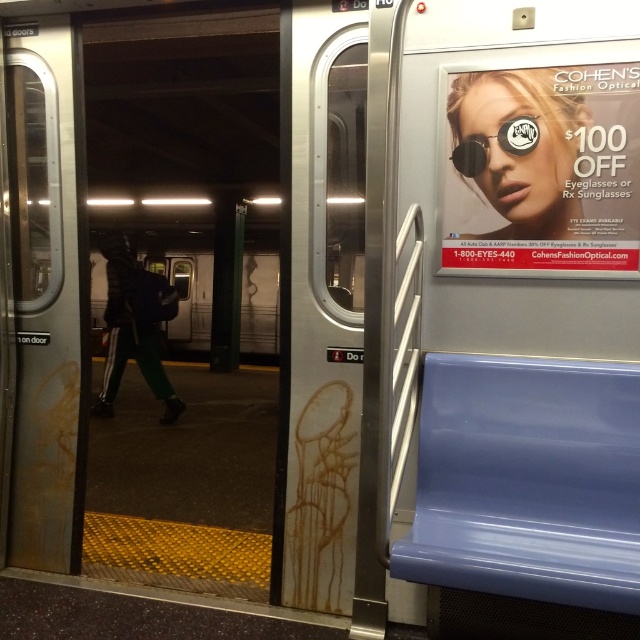
Question: Which of the following is the closest to the observer?

Choices:
 (A) green fabric pants at left
 (B) matte plastic sign at upper right
 (C) metallic silver door at left
 (D) metallic silver door at center

Answer: (B)

Question: Considering the relative positions of matte plastic sign at upper right and sunglasses at upper right in the image provided, where is matte plastic sign at upper right located with respect to sunglasses at upper right?

Choices:
 (A) above
 (B) below

Answer: (B)

Question: Among these objects, which one is farthest from the camera?

Choices:
 (A) metallic silver door at center
 (B) sunglasses at upper right

Answer: (A)

Question: From the image, what is the correct spatial relationship of metallic silver door at left in relation to green fabric pants at left?

Choices:
 (A) left
 (B) right

Answer: (B)

Question: Which of the following is the closest to the observer?

Choices:
 (A) (184, 68)
 (B) (476, 83)
 (C) (33, 112)

Answer: (B)

Question: Does metallic silver door at center appear on the left side of sunglasses at upper right?

Choices:
 (A) yes
 (B) no

Answer: (A)